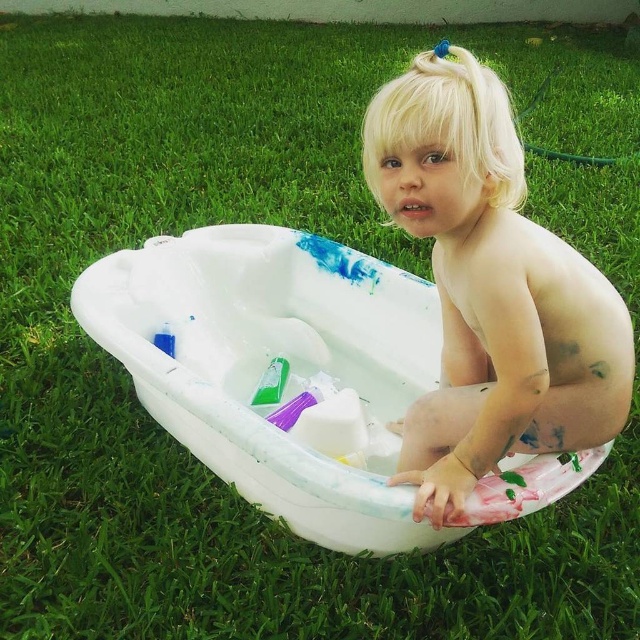
Question: Which of the following is the closest to the observer?

Choices:
 (A) blonde hair at upper center
 (B) white plastic tub at center

Answer: (A)

Question: Which point is closer to the camera taking this photo?

Choices:
 (A) (266, 376)
 (B) (284, 355)

Answer: (A)

Question: Is blonde hair at upper center in front of green plastic cup at center?

Choices:
 (A) yes
 (B) no

Answer: (A)

Question: Considering the real-world distances, which object is closest to the blonde hair at upper center?

Choices:
 (A) green plastic cup at center
 (B) white plastic tub at center

Answer: (B)

Question: Is blonde hair at upper center further to camera compared to green plastic cup at center?

Choices:
 (A) no
 (B) yes

Answer: (A)

Question: Considering the relative positions of blonde hair at upper center and green plastic cup at center in the image provided, where is blonde hair at upper center located with respect to green plastic cup at center?

Choices:
 (A) above
 (B) below

Answer: (A)